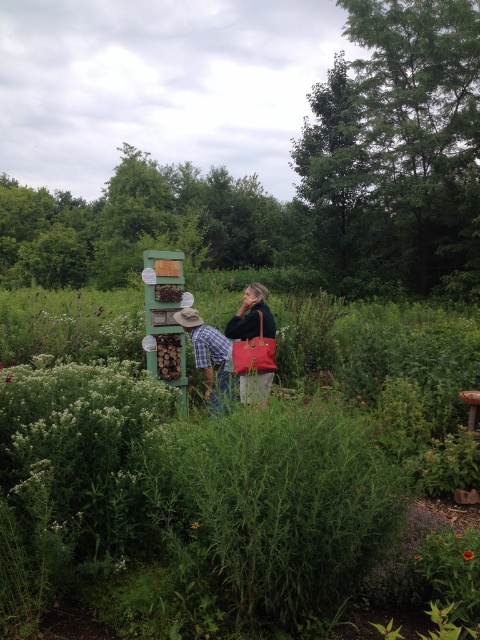
Question: Is green wooden post at center above matte brown hat at center?

Choices:
 (A) yes
 (B) no

Answer: (A)

Question: Can you confirm if green wooden post at center is bigger than leather handbag at center?

Choices:
 (A) yes
 (B) no

Answer: (A)

Question: Is plaid shirt at center positioned behind yellow matte flower at center?

Choices:
 (A) yes
 (B) no

Answer: (A)

Question: Among these objects, which one is nearest to the camera?

Choices:
 (A) green wooden post at center
 (B) matte brown hat at center
 (C) plaid shirt at center

Answer: (A)

Question: Which of the following is the farthest from the observer?

Choices:
 (A) plaid shirt at center
 (B) orange matte flower at center
 (C) purple matte flower at center

Answer: (A)

Question: Which is farther from the matte brown hat at center?

Choices:
 (A) orange matte flower at center
 (B) yellow matte flower at center
 (C) plaid shirt at center
 (D) green wooden post at center

Answer: (A)